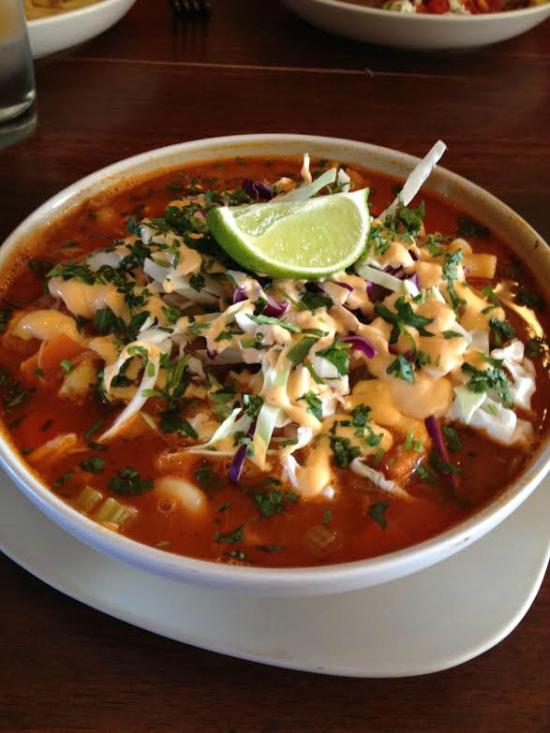
Identify the location of plate. (168, 616).